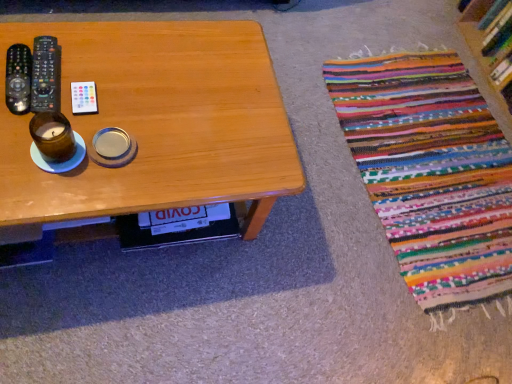
The width and height of the screenshot is (512, 384). Find the location of `free location to the right of black plastic remote at left, the 2th remote control in the right-to-left sequence`. free location to the right of black plastic remote at left, the 2th remote control in the right-to-left sequence is located at coordinates (119, 98).